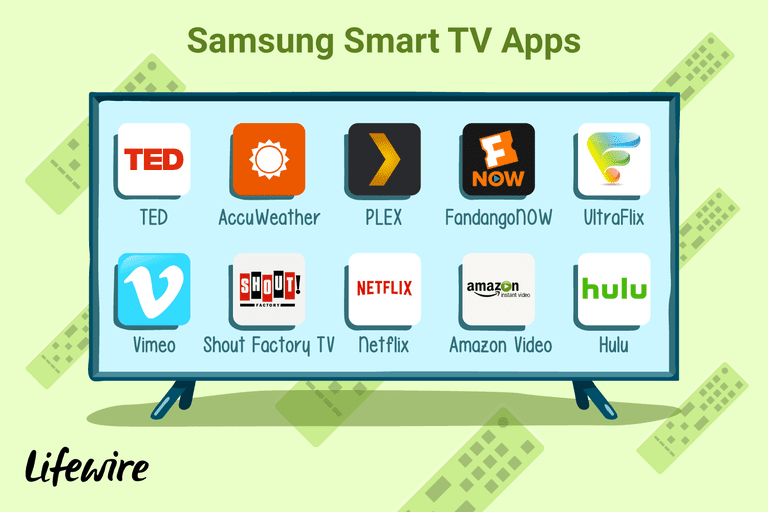
The image size is (768, 512). I want to click on tv stand, so click(606, 401), click(581, 401), click(169, 398), click(190, 397).